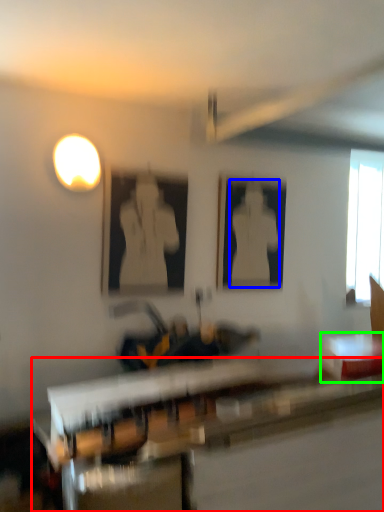
Question: Considering the real-world distances, which object is closest to table (highlighted by a red box)? person (highlighted by a blue box) or table (highlighted by a green box).

Choices:
 (A) person
 (B) table

Answer: (B)